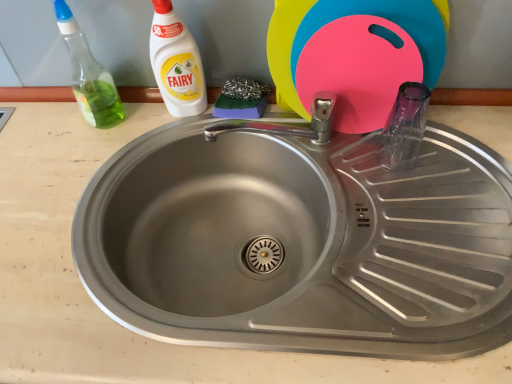
Question: Should I look upward or downward to see transparent glass bottle at right?

Choices:
 (A) up
 (B) down

Answer: (A)

Question: From the image's perspective, is pink plastic cutting board at upper right beneath white plastic bottle at upper left, which is counted as the 1th cleaning product, starting from the right?

Choices:
 (A) no
 (B) yes

Answer: (A)

Question: Is pink plastic cutting board at upper right positioned far away from white plastic bottle at upper left, which is counted as the 1th cleaning product, starting from the right?

Choices:
 (A) no
 (B) yes

Answer: (A)

Question: Would you say pink plastic cutting board at upper right contains white plastic bottle at upper left, which is counted as the 1th cleaning product, starting from the right?

Choices:
 (A) yes
 (B) no

Answer: (B)

Question: Does pink plastic cutting board at upper right have a lesser width compared to white plastic bottle at upper left, placed as the 2th cleaning product when sorted from left to right?

Choices:
 (A) yes
 (B) no

Answer: (B)

Question: Considering the relative positions of pink plastic cutting board at upper right and white plastic bottle at upper left, which is counted as the 1th cleaning product, starting from the right, in the image provided, is pink plastic cutting board at upper right to the right of white plastic bottle at upper left, which is counted as the 1th cleaning product, starting from the right, from the viewer's perspective?

Choices:
 (A) no
 (B) yes

Answer: (B)

Question: From the image's perspective, is pink plastic cutting board at upper right over white plastic bottle at upper left, which is counted as the 1th cleaning product, starting from the right?

Choices:
 (A) yes
 (B) no

Answer: (A)

Question: Considering the relative positions of stainless steel sink at center and pink plastic cutting board at upper right in the image provided, is stainless steel sink at center to the right of pink plastic cutting board at upper right from the viewer's perspective?

Choices:
 (A) no
 (B) yes

Answer: (A)

Question: Does stainless steel sink at center turn towards pink plastic cutting board at upper right?

Choices:
 (A) no
 (B) yes

Answer: (A)

Question: Is stainless steel sink at center thinner than pink plastic cutting board at upper right?

Choices:
 (A) no
 (B) yes

Answer: (A)

Question: Is stainless steel sink at center not inside pink plastic cutting board at upper right?

Choices:
 (A) yes
 (B) no

Answer: (A)

Question: Does stainless steel sink at center come behind pink plastic cutting board at upper right?

Choices:
 (A) yes
 (B) no

Answer: (B)

Question: Is stainless steel sink at center to the left of pink plastic cutting board at upper right from the viewer's perspective?

Choices:
 (A) yes
 (B) no

Answer: (A)

Question: Is transparent glass bottle at right thinner than pink plastic cutting board at upper right?

Choices:
 (A) no
 (B) yes

Answer: (B)